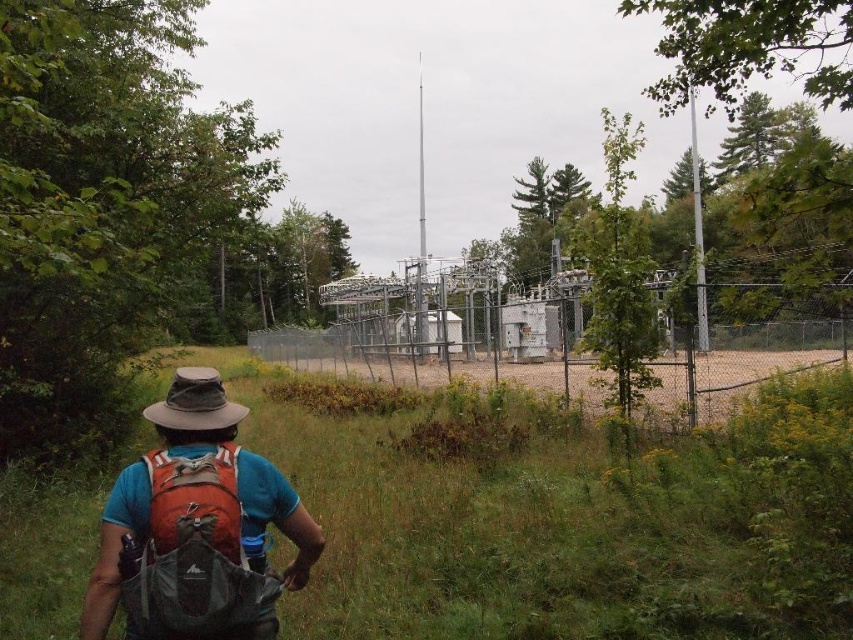
Question: Considering the real-world distances, which object is closest to the matte orange backpack at lower left?

Choices:
 (A) green grass at center
 (B) brown sandy dirt field at center
 (C) matte orange backpack at center
 (D) brown fabric hat at upper center

Answer: (C)

Question: Can you confirm if matte orange backpack at center is positioned above matte orange backpack at lower left?

Choices:
 (A) no
 (B) yes

Answer: (A)

Question: Does green grass at center appear on the left side of matte orange backpack at center?

Choices:
 (A) yes
 (B) no

Answer: (B)

Question: Is green grass at center smaller than brown fabric hat at upper center?

Choices:
 (A) yes
 (B) no

Answer: (B)

Question: Which object appears farthest from the camera in this image?

Choices:
 (A) green grass at center
 (B) matte orange backpack at lower left
 (C) brown fabric hat at upper center
 (D) brown sandy dirt field at center

Answer: (D)

Question: Which object appears closest to the camera in this image?

Choices:
 (A) green grass at center
 (B) matte orange backpack at center

Answer: (B)